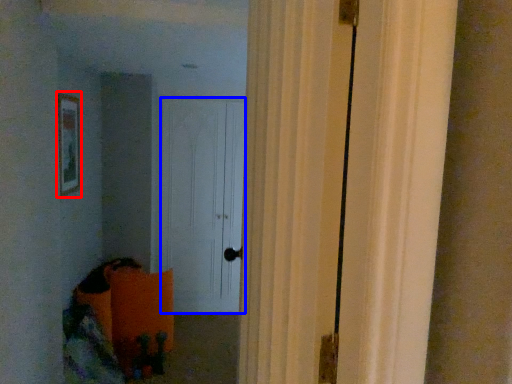
Question: Among these objects, which one is farthest to the camera, picture frame (highlighted by a red box) or door (highlighted by a blue box)?

Choices:
 (A) picture frame
 (B) door

Answer: (B)